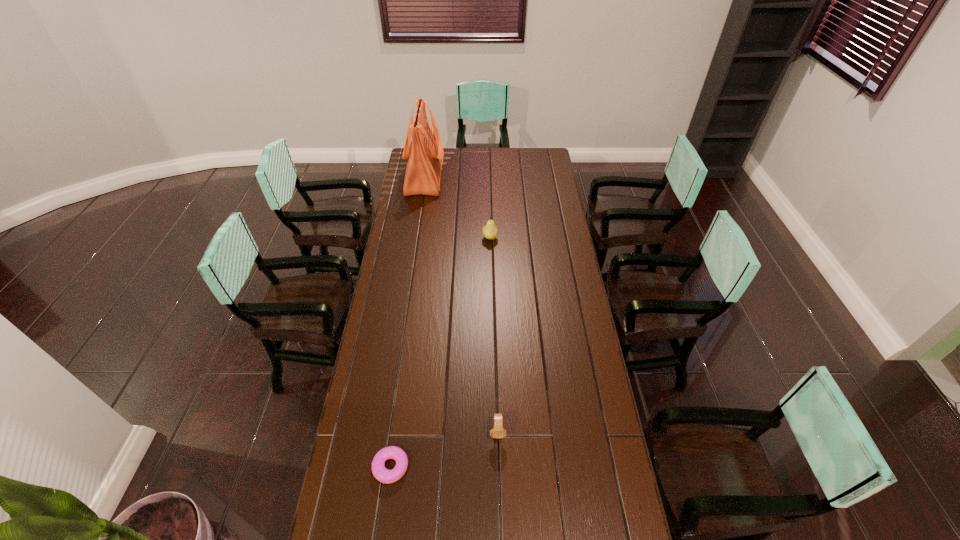
Where is `shopping bag`? shopping bag is located at coordinates (425, 153).

In order to click on the tallest object in this screenshot , I will do `click(425, 153)`.

Where is `the second tallest object`? the second tallest object is located at coordinates (489, 231).

What are the coordinates of `the second farthest object` in the screenshot? It's located at coord(489,231).

This screenshot has width=960, height=540. Find the location of `the second nearest object`. the second nearest object is located at coordinates (497, 432).

The width and height of the screenshot is (960, 540). I want to click on watch, so click(x=497, y=432).

Locate an element on the screen. This screenshot has height=540, width=960. the shortest object is located at coordinates (379, 471).

Find the location of a particular element. doughnut is located at coordinates (379, 471).

Identify the location of free space located 0.160m on the front pocket of the shopping bag. The width and height of the screenshot is (960, 540). (472, 177).

This screenshot has width=960, height=540. Identify the location of free space located 0.350m on the back of the third nearest object. click(x=489, y=192).